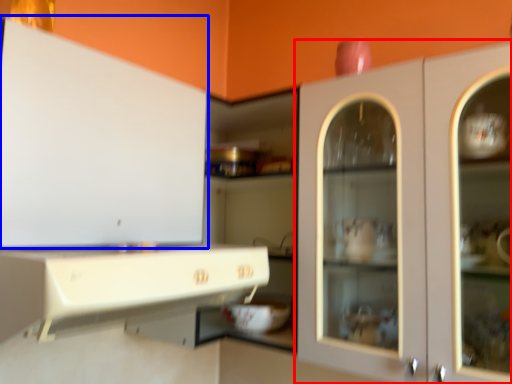
Question: Among these objects, which one is nearest to the camera, cabinetry (highlighted by a red box) or cabinetry (highlighted by a blue box)?

Choices:
 (A) cabinetry
 (B) cabinetry

Answer: (B)